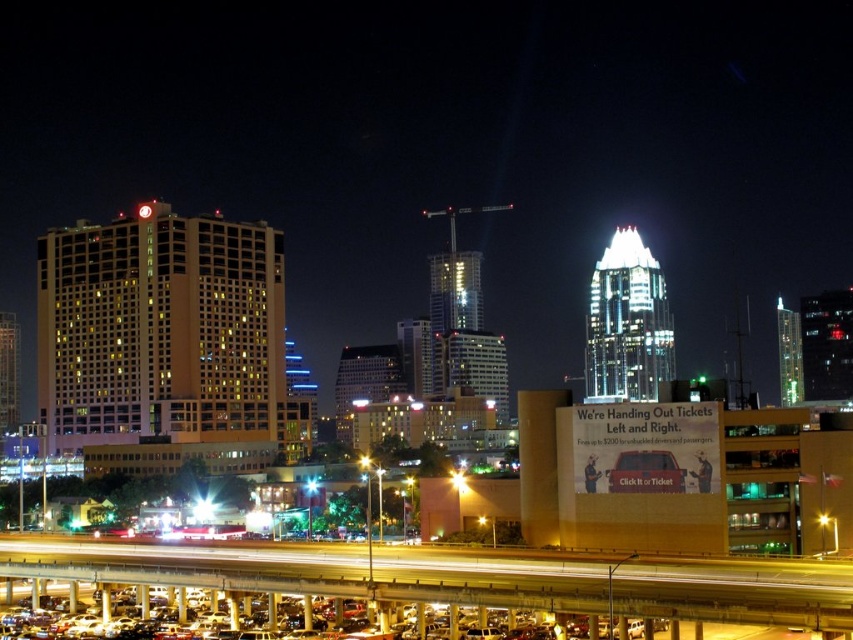
You are a delivery drone that needs to fly from the yellow concrete highway at lower center to the metallic cars at lower center. The minimum safe distance for your drone to navigate between objects is 10 feet. Can you safely make this flight?

The yellow concrete highway at lower center is 9.06 feet away from metallic cars at lower center. Since the distance is less than the minimum safe requirement of 10 feet, the drone cannot safely make this flight.

In the scene shown: You are a pedestrian standing on the sidewalk and see the yellow concrete highway at lower center and the metallic cars at lower center. Which object is located to the right of the other?

The yellow concrete highway at lower center is positioned on the right side of metallic cars at lower center.